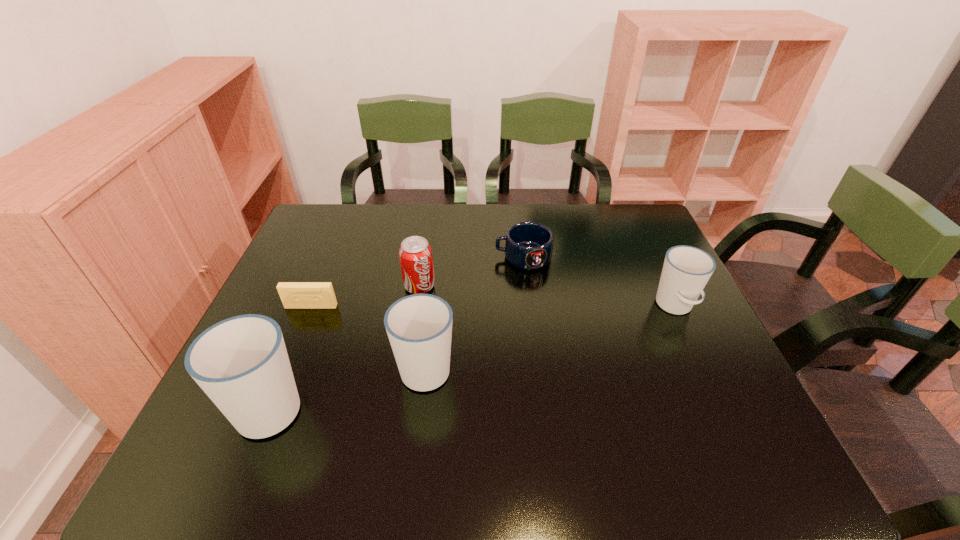
I want to click on the leftmost cup, so click(x=241, y=363).

Locate an element on the screen. This screenshot has height=540, width=960. the second cup from left to right is located at coordinates (419, 327).

What are the coordinates of `the second tallest object` in the screenshot? It's located at (x=419, y=327).

At what (x,y) coordinates should I click in order to perform the action: click on the rightmost object. Please return your answer as a coordinate pair (x, y). Looking at the image, I should click on (686, 270).

Identify the location of the shortest cup. (686, 270).

This screenshot has height=540, width=960. Find the location of `videotape`. videotape is located at coordinates (294, 295).

This screenshot has width=960, height=540. Find the location of `mug`. mug is located at coordinates (528, 245).

I want to click on the farthest object, so click(528, 245).

You are a GUI agent. You are given a task and a screenshot of the screen. Output one action in this format:
    pyautogui.click(x=<x>, y=<y>)
    Task: Click on the soda
    The image size is (960, 540).
    Given the screenshot: What is the action you would take?
    pyautogui.click(x=416, y=261)

This screenshot has width=960, height=540. What are the coordinates of `vacant area situated 0.180m with a handle on the side of the leftmost cup` in the screenshot? It's located at (309, 313).